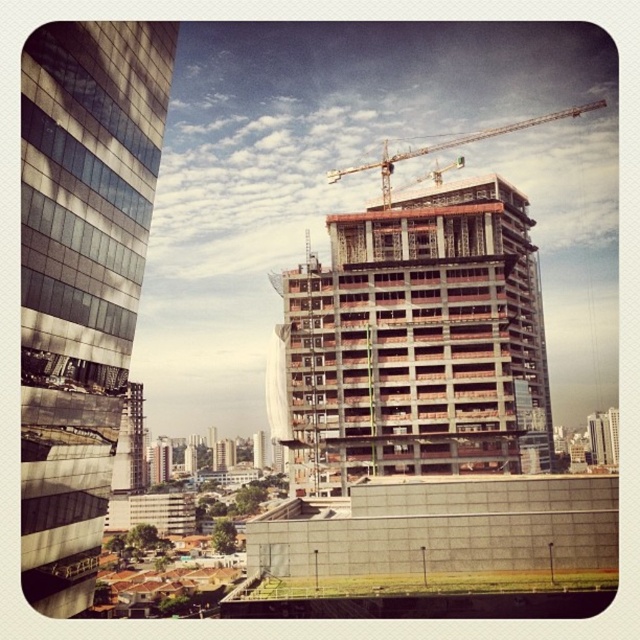
From the picture: You are a delivery person with a 100 kg package that needs to be delivered to the construction site. The concrete building at center is the destination. There is a crane located at the top of the building. Can the crane lift the package? Please explain your answer.

The crane located at the top of the concrete building at center can lift the 100 kg package as most construction cranes have a lifting capacity well above 100 kg. However, the crane operator must ensure the load is properly secured and within the crane manufacturer specifications.

You are a construction worker standing at the base of the reflective glass building at left. You need to move to the concrete building at center. Which direction should you walk to reach it?

The concrete building at center is to the right of the reflective glass building at left, so you should walk to the right to reach it.

You are an architect planning to install a new antenna on the reflective glass building at left and the metallic construction crane at upper center. Which structure will require a wider base to support the antenna?

The metallic construction crane at upper center requires a wider base because it is thicker than the reflective glass building at left.